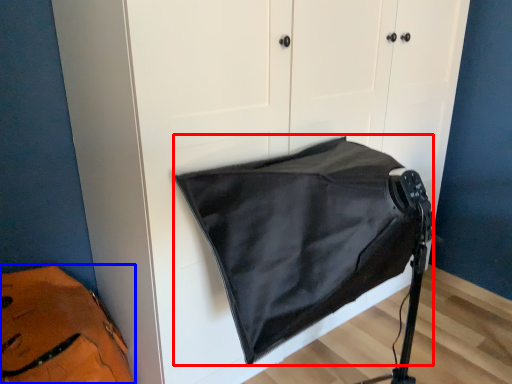
Question: Which object is further to the camera taking this photo, sleeping bag (highlighted by a red box) or messenger bag (highlighted by a blue box)?

Choices:
 (A) sleeping bag
 (B) messenger bag

Answer: (B)